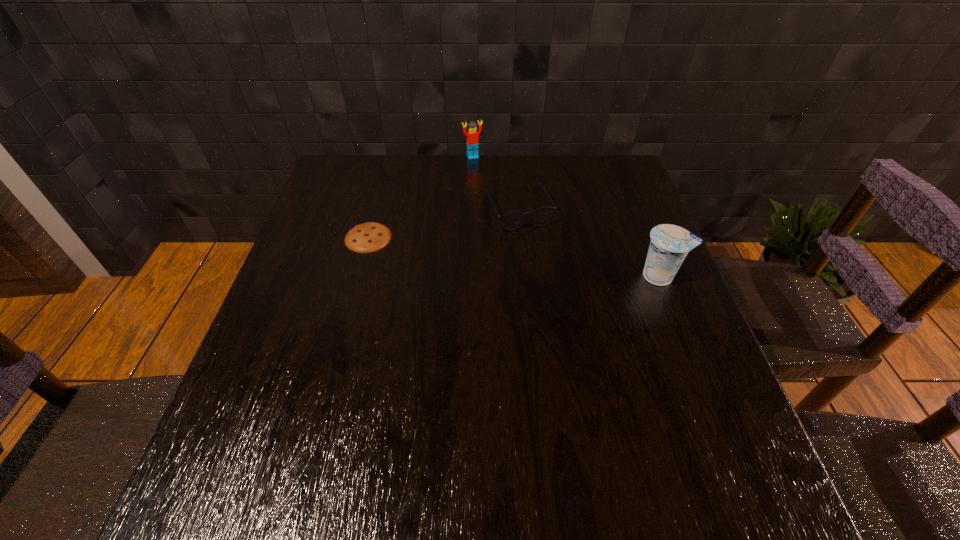
Find the location of a particular element. vacant space situated on the face of the Lego is located at coordinates (508, 218).

You are a GUI agent. You are given a task and a screenshot of the screen. Output one action in this format:
    pyautogui.click(x=<x>, y=<y>)
    Task: Click on the vacant area situated on the face of the Lego
    The image size is (960, 540).
    Given the screenshot: What is the action you would take?
    pyautogui.click(x=495, y=195)

Image resolution: width=960 pixels, height=540 pixels. I want to click on vacant space located on the face of the Lego, so click(x=484, y=174).

Identify the location of free space located on the front-facing side of the second shortest object. The width and height of the screenshot is (960, 540). (566, 312).

In order to click on free spot located 0.130m on the front-facing side of the second shortest object in this screenshot , I will do `click(544, 265)`.

The height and width of the screenshot is (540, 960). Identify the location of vacant space located on the front-facing side of the second shortest object. (555, 286).

In order to click on Lego that is at the far edge in this screenshot , I will do `click(472, 139)`.

You are a GUI agent. You are given a task and a screenshot of the screen. Output one action in this format:
    pyautogui.click(x=<x>, y=<y>)
    Task: Click on the spectacles located at the far edge
    This screenshot has height=540, width=960.
    Given the screenshot: What is the action you would take?
    pyautogui.click(x=513, y=220)

At what (x,y) coordinates should I click in order to perform the action: click on object that is positioned at the left edge. Please return your answer as a coordinate pair (x, y). Image resolution: width=960 pixels, height=540 pixels. Looking at the image, I should click on (364, 238).

This screenshot has height=540, width=960. I want to click on object that is at the right edge, so click(x=670, y=244).